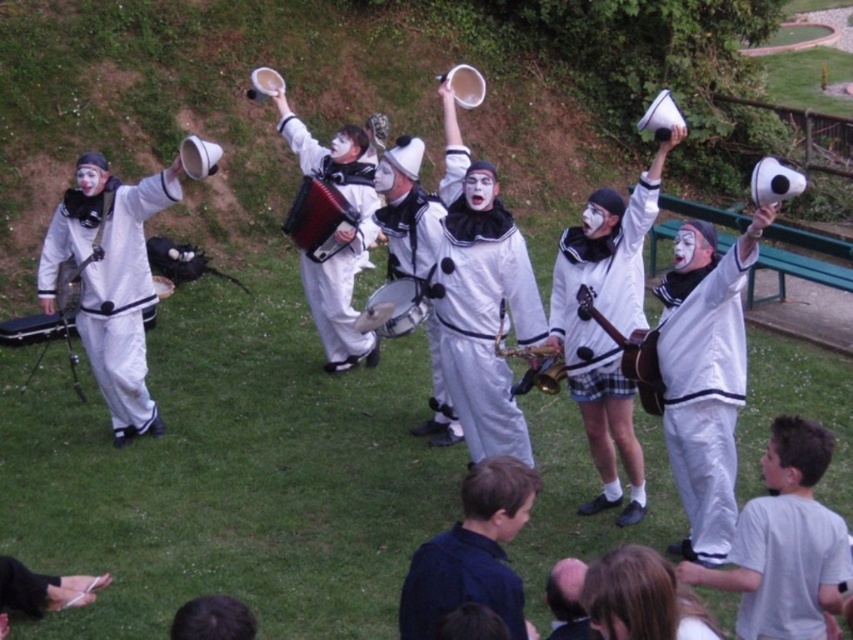
Which of these two, white matte jacket at upper right or white matte clown suit at left, stands taller?

white matte clown suit at left

Is white matte jacket at upper right to the right of white matte clown suit at left from the viewer's perspective?

Yes, white matte jacket at upper right is to the right of white matte clown suit at left.

The width and height of the screenshot is (853, 640). Find the location of `white matte jacket at upper right`. white matte jacket at upper right is located at coordinates (705, 397).

Who is lower down, white matte accordion at center or metallic silver drum at center?

Positioned lower is metallic silver drum at center.

Identify the location of white matte accordion at center. The width and height of the screenshot is (853, 640). (337, 240).

What do you see at coordinates (337, 240) in the screenshot? I see `white matte accordion at center` at bounding box center [337, 240].

Find the location of a particular element. white matte accordion at center is located at coordinates (337, 240).

Is white matte sailor suit at center behind white matte accordion at center?

No, white matte sailor suit at center is closer to the viewer.

Which of these two, white matte sailor suit at center or white matte accordion at center, stands taller?

Standing taller between the two is white matte accordion at center.

Where is `white matte sailor suit at center`? The width and height of the screenshot is (853, 640). white matte sailor suit at center is located at coordinates (483, 314).

The image size is (853, 640). Find the location of `white matte sailor suit at center`. white matte sailor suit at center is located at coordinates (483, 314).